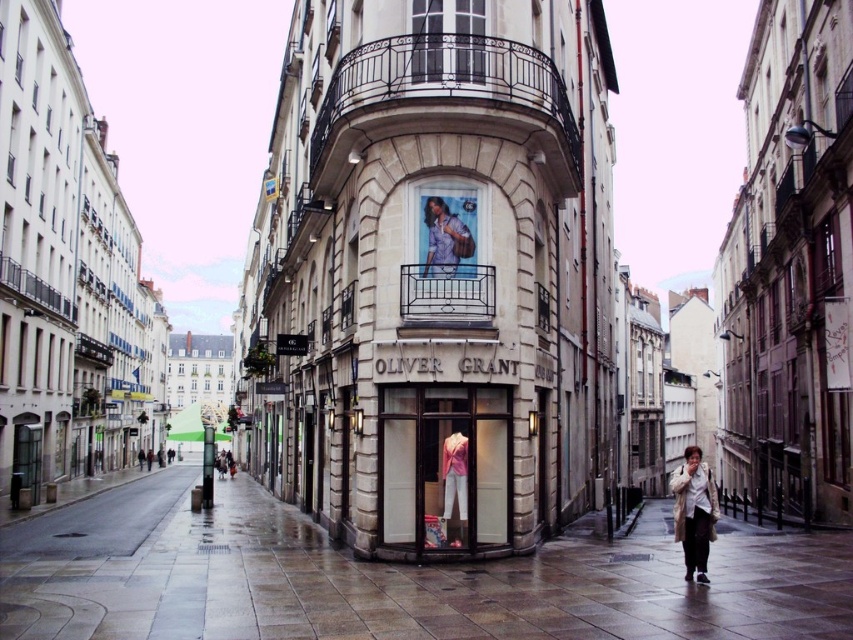
Does dark gray wrought iron balcony at center appear over pink fabric mannequin at center?

Indeed, dark gray wrought iron balcony at center is positioned over pink fabric mannequin at center.

Can you confirm if dark gray wrought iron balcony at center is taller than pink fabric mannequin at center?

No.

The image size is (853, 640). Find the location of `dark gray wrought iron balcony at center`. dark gray wrought iron balcony at center is located at coordinates (444, 102).

You are a GUI agent. You are given a task and a screenshot of the screen. Output one action in this format:
    pyautogui.click(x=<x>, y=<y>)
    Task: Click on the dark gray wrought iron balcony at center
    The image size is (853, 640).
    Given the screenshot: What is the action you would take?
    pyautogui.click(x=444, y=102)

Can you confirm if smooth stone pavement at center is thinner than matte purple blouse at upper center?

In fact, smooth stone pavement at center might be wider than matte purple blouse at upper center.

Does point (654, 577) come behind point (448, 227)?

No.

This screenshot has width=853, height=640. Identify the location of smooth stone pavement at center. (395, 579).

Does matte purple blouse at upper center appear under pink fabric dress at center?

No.

Is matte purple blouse at upper center thinner than pink fabric dress at center?

No.

Between point (442, 212) and point (457, 468), which one is positioned behind?

Point (442, 212)

Locate an element on the screen. matte purple blouse at upper center is located at coordinates (444, 237).